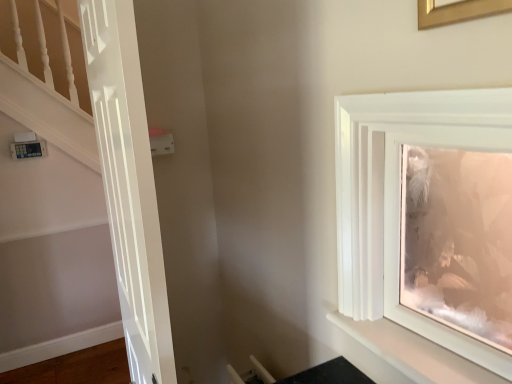
Question: Is point (167, 132) positioned closer to the camera than point (435, 115)?

Choices:
 (A) farther
 (B) closer

Answer: (A)

Question: From a real-world perspective, is white plastic light switch at upper center positioned above or below white glossy frame at upper right?

Choices:
 (A) below
 (B) above

Answer: (B)

Question: Considering the real-world distances, which object is closest to the white glossy door at left?

Choices:
 (A) white plastic light switch at upper center
 (B) white glossy shelf at upper right
 (C) matte white picture frame at upper right, the first picture frame in the back-to-front sequence
 (D) gold metallic picture frame at upper right, arranged as the 2th picture frame when viewed from the back
 (E) white glossy frame at upper right

Answer: (E)

Question: Which object is positioned closest to the white glossy frame at upper right?

Choices:
 (A) white glossy shelf at upper right
 (B) white plastic light switch at upper center
 (C) matte white picture frame at upper right, the first picture frame in the back-to-front sequence
 (D) gold metallic picture frame at upper right, arranged as the 2th picture frame when viewed from the back
 (E) white glossy door at left

Answer: (A)